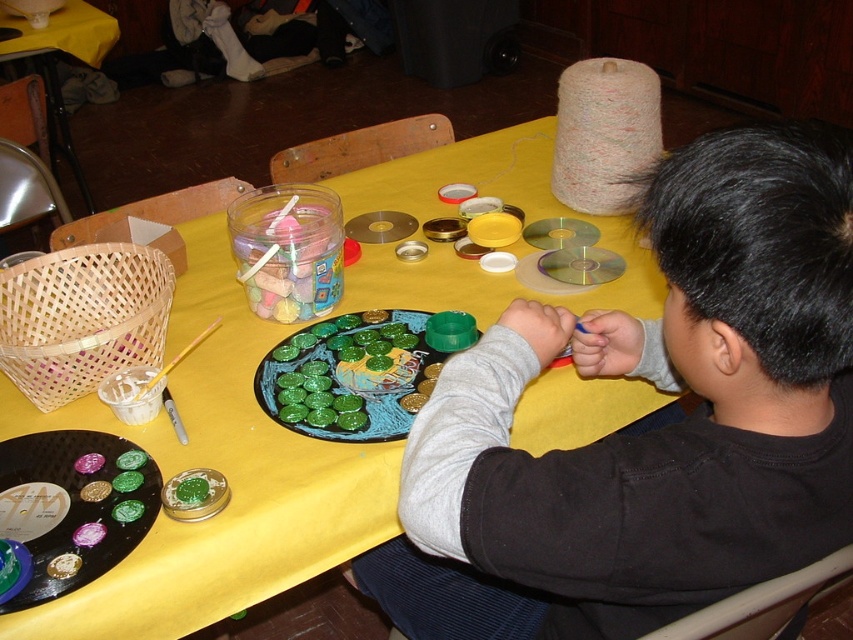
You are a craft instructor observing the child and their table setup. You need to place a new craft kit on the surface that has more width. Which object should you choose between the black matte shirt at upper right and the yellow fabric table at lower left?

The yellow fabric table at lower left has a greater width than the black matte shirt at upper right, so you should place the craft kit on the yellow fabric table at lower left.

You are organizing a craft fair and need to place two yellow fabric tables in the room. The yellow fabric table at center and the yellow fabric table at lower left are available. Which one should you choose if you want the larger table for displaying more craft supplies?

The yellow fabric table at lower left is larger in size compared to the yellow fabric table at center, so you should choose the yellow fabric table at lower left for displaying more craft supplies.

You are a craft instructor observing the child at the table. You notice two points marked on the table surface. The first point is at coordinates point (415,298) and the second point is at point (77,29). Which point is closer to you as you face the table?

Point (415,298) is closer to the viewer than point (77,29).